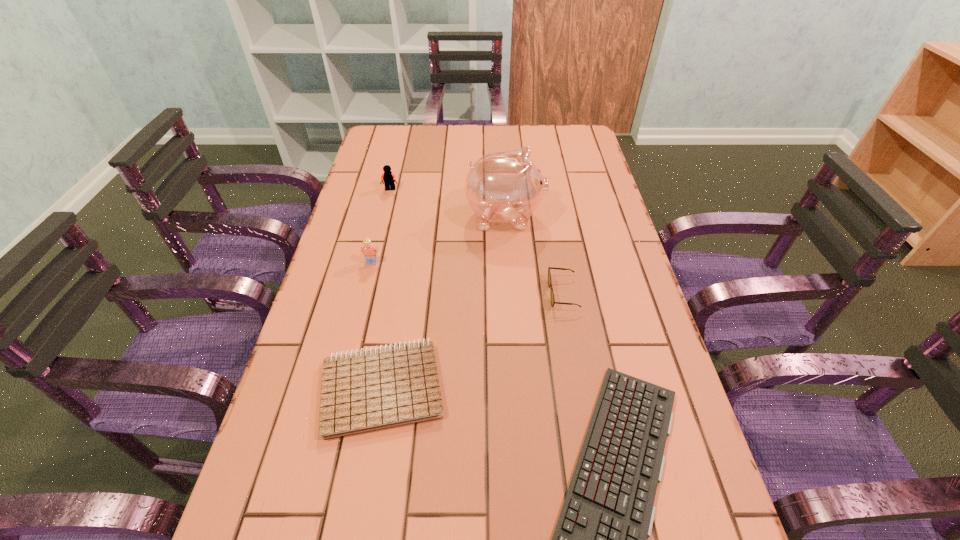
You are a GUI agent. You are given a task and a screenshot of the screen. Output one action in this format:
    pyautogui.click(x=<x>, y=<y>)
    Task: Click on the free space between the fifth tallest object and the farthest object
    
    Given the screenshot: What is the action you would take?
    pyautogui.click(x=387, y=288)

Where is `free space between the farthest object and the nearer Lego`? This screenshot has height=540, width=960. free space between the farthest object and the nearer Lego is located at coordinates (381, 226).

Where is `vacant area that lies between the notebook and the fourth farthest object`? This screenshot has height=540, width=960. vacant area that lies between the notebook and the fourth farthest object is located at coordinates (473, 340).

You are a GUI agent. You are given a task and a screenshot of the screen. Output one action in this format:
    pyautogui.click(x=<x>, y=<y>)
    Task: Click on the free point between the sunglasses and the fourth nearest object
    The image size is (960, 540).
    Given the screenshot: What is the action you would take?
    pyautogui.click(x=468, y=278)

The image size is (960, 540). I want to click on vacant point located between the farther Lego and the tallest object, so click(x=447, y=203).

Where is `vacant area that lies between the third shortest object and the fifth tallest object`? The height and width of the screenshot is (540, 960). vacant area that lies between the third shortest object and the fifth tallest object is located at coordinates (473, 340).

I want to click on vacant point located between the sunglasses and the third farthest object, so click(x=468, y=278).

Locate which object is the second closest to the fifth tallest object. Please provide its 2D coordinates. Your answer should be formatted as a tuple, i.e. [(x, y)], where the tuple contains the x and y coordinates of a point satisfying the conditions above.

[(370, 252)]

You are a GUI agent. You are given a task and a screenshot of the screen. Output one action in this format:
    pyautogui.click(x=<x>, y=<y>)
    Task: Click on the object that stands as the third closest to the piggy bank
    The image size is (960, 540).
    Given the screenshot: What is the action you would take?
    pyautogui.click(x=370, y=252)

This screenshot has height=540, width=960. I want to click on free space in the image that satisfies the following two spatial constraints: 1. on the front-facing side of the fourth nearest object; 2. on the left side of the fifth tallest object, so click(342, 387).